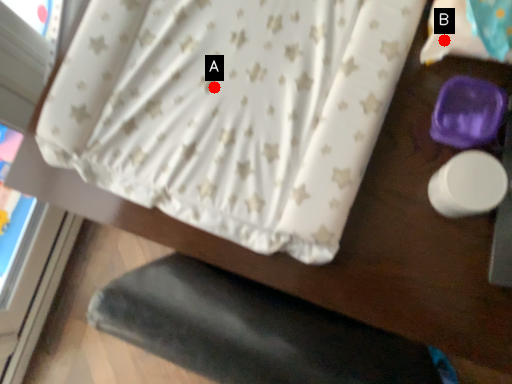
Question: Two points are circled on the image, labeled by A and B beside each circle. Which point appears closest to the camera in this image?

Choices:
 (A) A is closer
 (B) B is closer

Answer: (B)